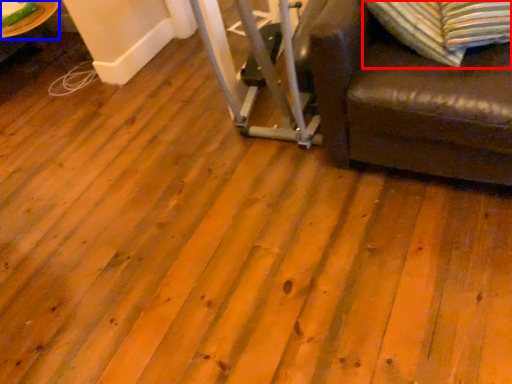
Question: Which object appears farthest to the camera in this image, pillow (highlighted by a red box) or table (highlighted by a blue box)?

Choices:
 (A) pillow
 (B) table

Answer: (B)